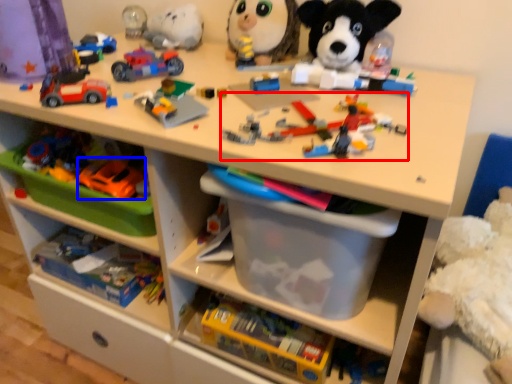
Question: Which object is closer to the camera taking this photo, toy (highlighted by a red box) or toy (highlighted by a blue box)?

Choices:
 (A) toy
 (B) toy

Answer: (A)